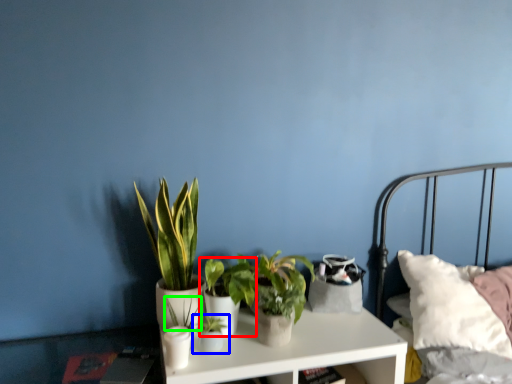
Question: Which object is positioned farthest from houseplant (highlighted by a red box)? Select from houseplant (highlighted by a blue box) and plant (highlighted by a green box).

Choices:
 (A) houseplant
 (B) plant

Answer: (B)